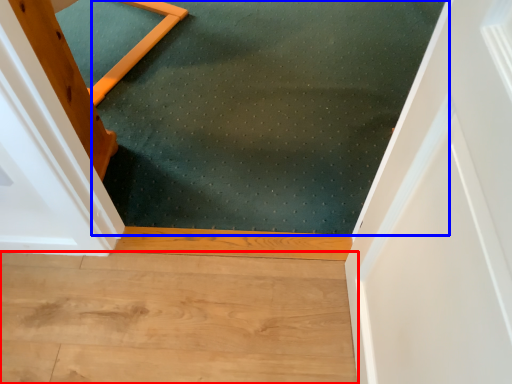
Question: Among these objects, which one is farthest to the camera, hardwood (highlighted by a red box) or mat (highlighted by a blue box)?

Choices:
 (A) hardwood
 (B) mat

Answer: (B)